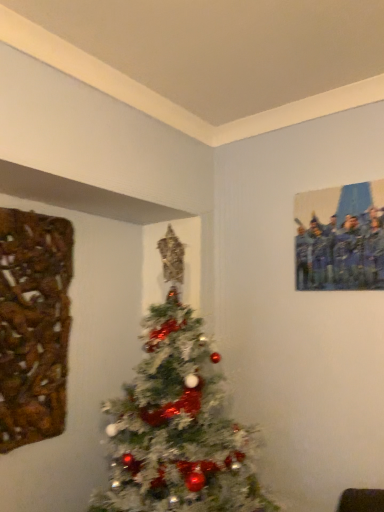
What do you see at coordinates (340, 238) in the screenshot? I see `blue fabric painting at upper right` at bounding box center [340, 238].

Locate an element on the screen. The width and height of the screenshot is (384, 512). blue fabric painting at upper right is located at coordinates (340, 238).

The height and width of the screenshot is (512, 384). I want to click on blue fabric painting at upper right, so pos(340,238).